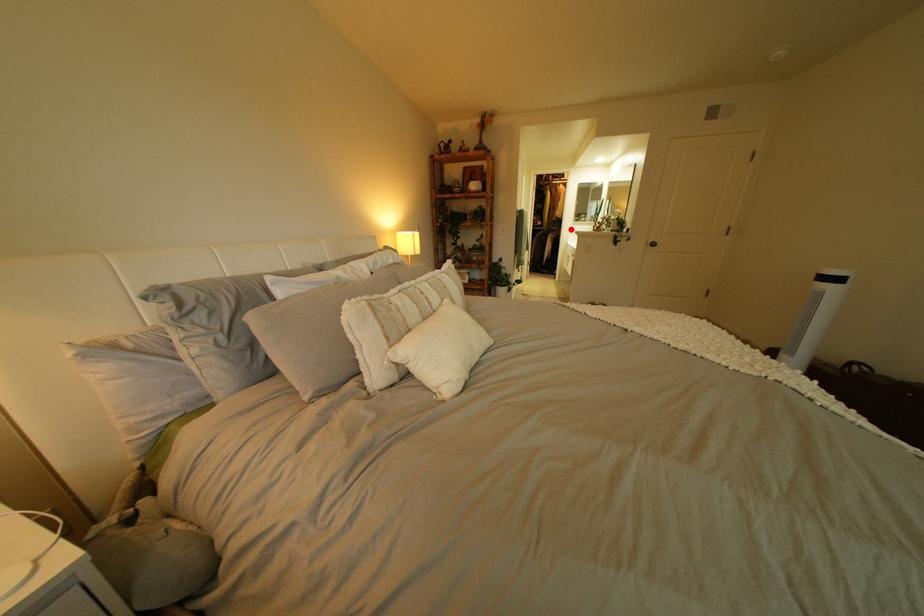
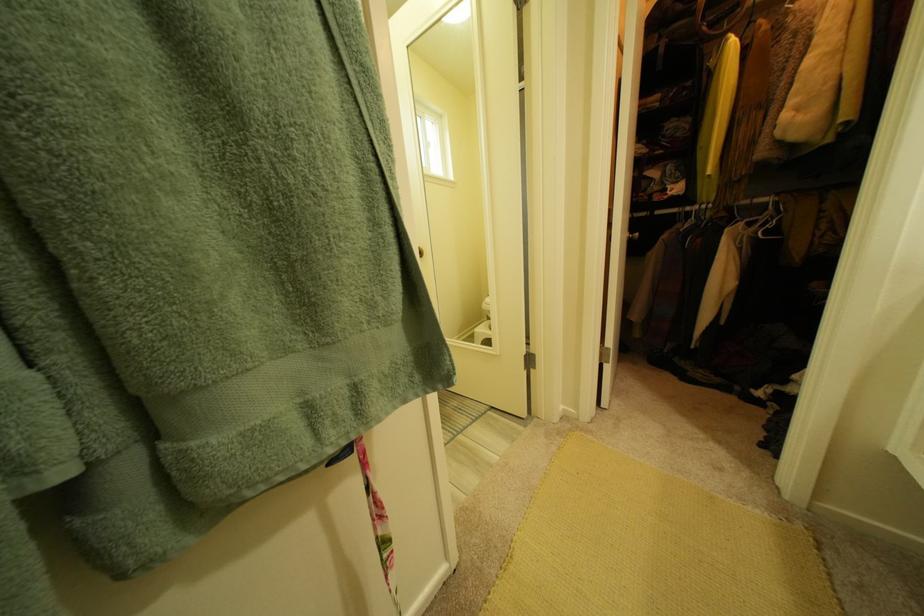
Where in the second image is the point corresponding to the highlighted location from the first image?

(777, 201)